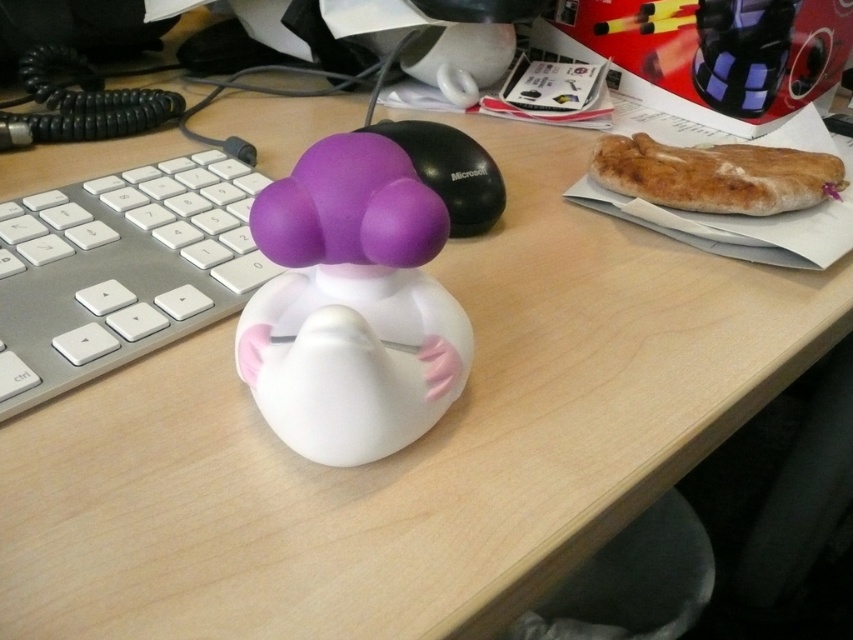
You are organizing items on your desk and need to place both the matte rubber duck at center and the black matte mouse at center into a drawer. The drawer has a height limit of 5 cm. Which item might not fit if the rubber duck is 4 cm tall and the mouse is 6 cm tall?

The black matte mouse at center is 6 cm tall, which exceeds the drawer height limit of 5 cm, so it might not fit.

You are organizing items on your desk and want to place a taller object between the bread crusty at right and the black matte mouse at center. Which object should you place it next to?

The black matte mouse at center is taller than the bread crusty at right, so you should place the taller object next to the bread crusty at right.